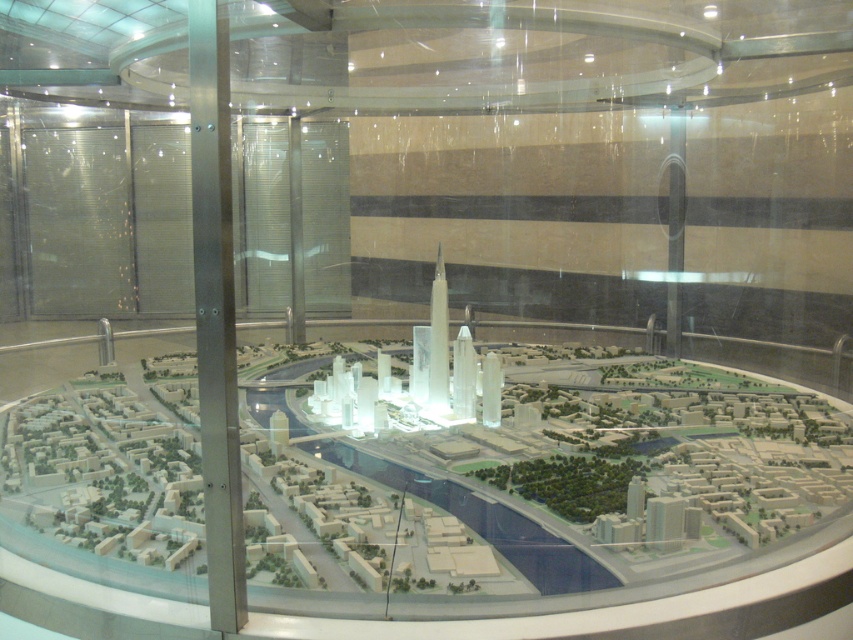
You are an architect examining the city model in the glass enclosure. You need to determine if the transparent plastic city model at center can be moved to the right side of the silver metallic pillar at center without removing the pillar. Can it fit there based on their sizes?

The transparent plastic city model at center is bigger than the silver metallic pillar at center. Since the model is larger, it cannot fit on the right side of the pillar without overlapping or rearranging other elements.

Looking at this image, you are an architect analyzing the city model. You observe two points marked in the model at coordinates point (x=334, y=532) and point (x=223, y=310). Which point is closer to your viewpoint?

Point (x=334, y=532) is further to the viewer than point (x=223, y=310), so the closer point to your viewpoint is point (x=223, y=310).